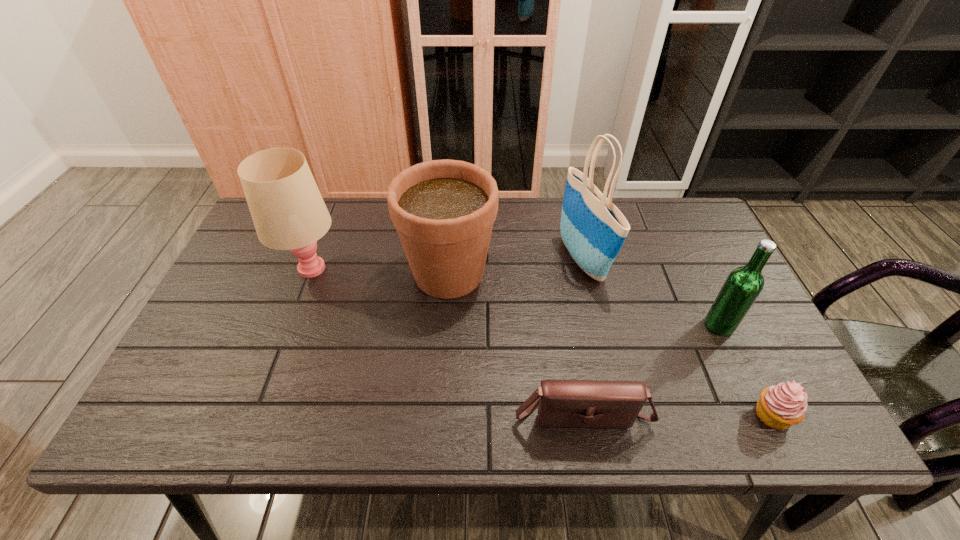
Locate an element on the screen. This screenshot has height=540, width=960. vacant point located between the tote bag and the second object from left to right is located at coordinates (516, 266).

This screenshot has height=540, width=960. I want to click on vacant space in between the tote bag and the fourth farthest object, so click(x=651, y=293).

At what (x,y) coordinates should I click in order to perform the action: click on vacant point located between the shoulder bag and the lampshade. Please return your answer as a coordinate pair (x, y). Looking at the image, I should click on (446, 340).

At what (x,y) coordinates should I click in order to perform the action: click on vacant area that lies between the shoulder bag and the tote bag. Please return your answer as a coordinate pair (x, y). The image size is (960, 540). Looking at the image, I should click on (582, 336).

Find the location of `free space between the beer bottle and the cupcake`. free space between the beer bottle and the cupcake is located at coordinates (746, 370).

What are the coordinates of `free point between the shoulder bag and the cupcake` in the screenshot? It's located at (677, 413).

Select which object is the second closest to the leftmost object. Please provide its 2D coordinates. Your answer should be formatted as a tuple, i.e. [(x, y)], where the tuple contains the x and y coordinates of a point satisfying the conditions above.

[(562, 403)]

Locate which object ranks second in proximity to the fifth tallest object. Please provide its 2D coordinates. Your answer should be formatted as a tuple, i.e. [(x, y)], where the tuple contains the x and y coordinates of a point satisfying the conditions above.

[(443, 210)]

Locate an element on the screen. free location that satisfies the following two spatial constraints: 1. on the front side of the second object from left to right; 2. on the left side of the fourth farthest object is located at coordinates (445, 325).

You are a GUI agent. You are given a task and a screenshot of the screen. Output one action in this format:
    pyautogui.click(x=<x>, y=<y>)
    Task: Click on the free space that satisfies the following two spatial constraints: 1. on the front flap of the shortest object; 2. on the right side of the fifth tallest object
    
    Given the screenshot: What is the action you would take?
    pyautogui.click(x=583, y=415)